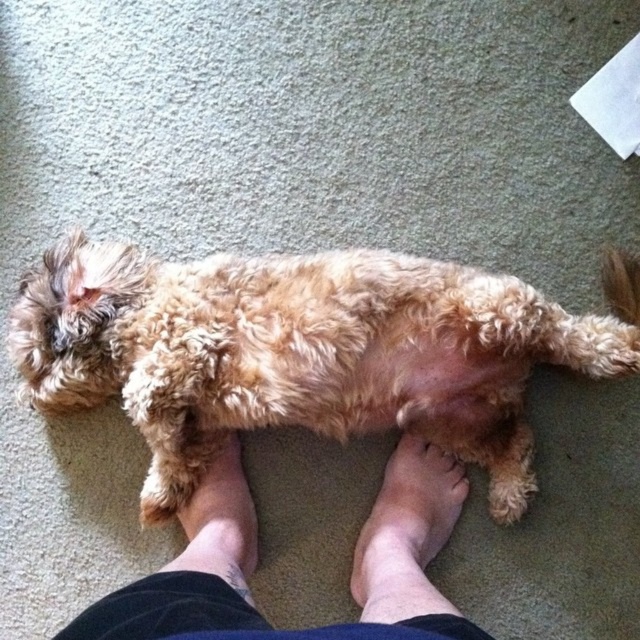
In the scene shown: Based on the scene, where is the fuzzy golden dog at center positioned in terms of coordinates?

The fuzzy golden dog at center is positioned at coordinates [307,352].

You are a photographer trying to capture a closeup of the brown furry foot at center while avoiding the barefoot feet at center. Based on their sizes, can you tell which one is easier to focus on without moving the camera?

The barefoot feet at center is much taller as brown furry foot at center, so the brown furry foot at center is smaller. Therefore, focusing on the brown furry foot at center might be easier since it requires less adjustment to frame it properly without the barefoot feet at center obstructing the shot.